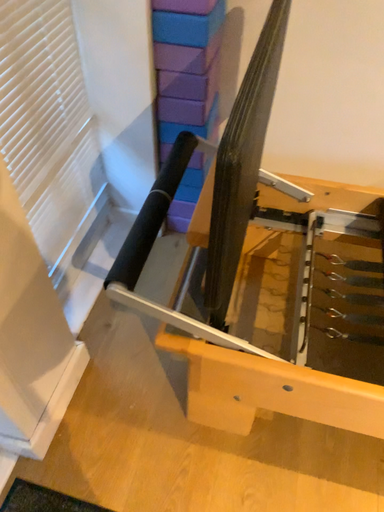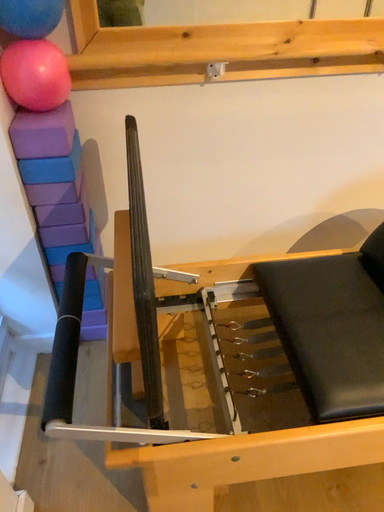
Question: Which way did the camera rotate in the video?

Choices:
 (A) rotated left
 (B) rotated right

Answer: (B)